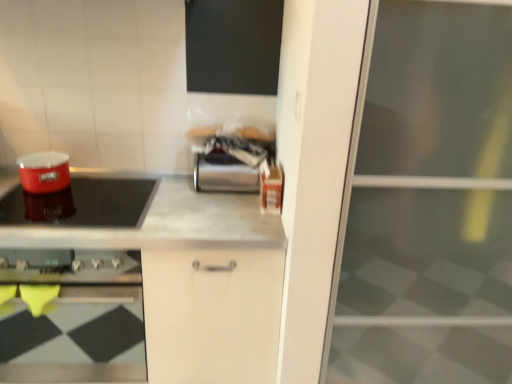
The image size is (512, 384). What are the coordinates of `spots to the right of shiny red pot at left` in the screenshot? It's located at (192, 210).